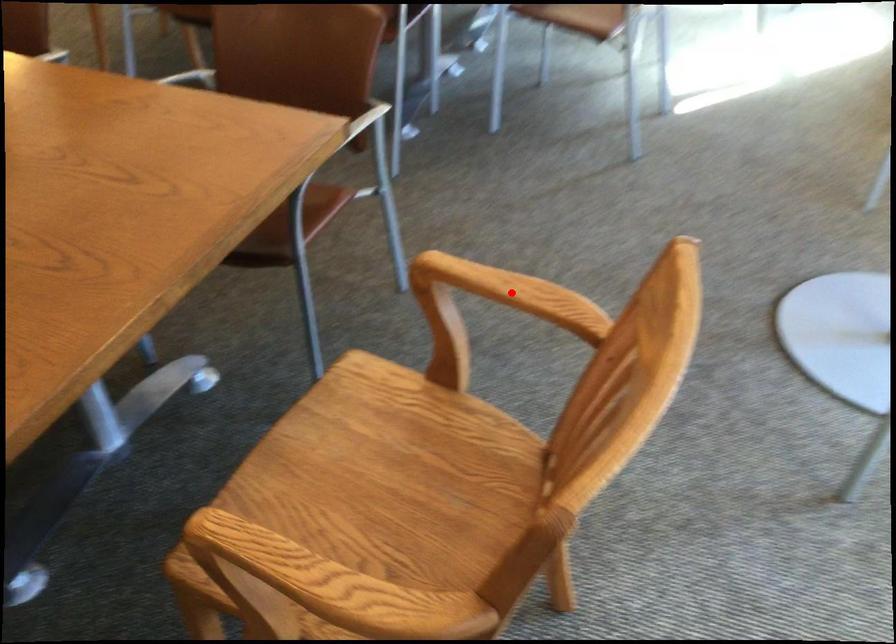
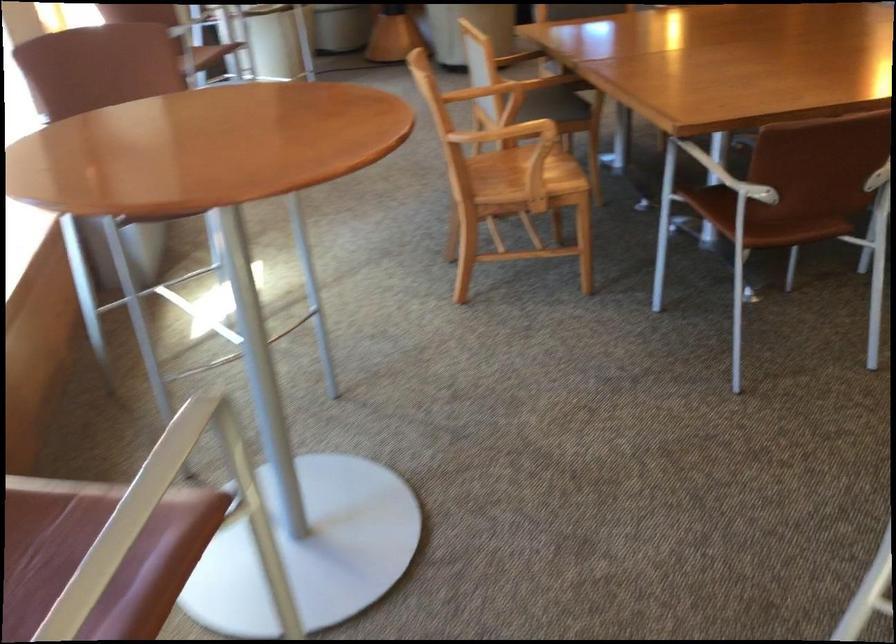
Question: I am providing you with two images of the same scene from different viewpoints. A red point is marked on the first image. Can you still see the location of the red point in image 2?

Choices:
 (A) Yes
 (B) No

Answer: (B)